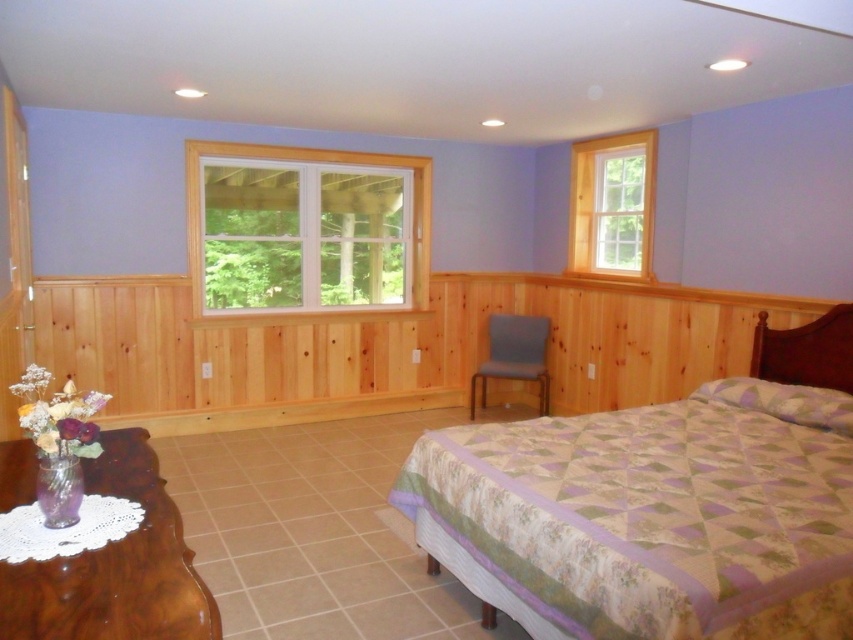
You are standing in the bedroom and want to look outside through the clear glass window at upper right. To do so, which direction should you move relative to the matte blue chair at center?

You should move to the right of the matte blue chair at center because the clear glass window at upper right is located to the right of the matte blue chair at center.

You are an interior designer planning to place a new piece of furniture in the bedroom. You have a choice between a small side table and a large bookshelf. The patterned fabric bed at center and the translucent glass vase at lower left are already in the room. Which existing object should you consider in terms of size when deciding where to place the large bookshelf?

The patterned fabric bed at center has a larger size compared to the translucent glass vase at lower left, so you should consider the size of the patterned fabric bed at center when deciding where to place the large bookshelf.

You are an interior designer planning to place a new decorative item between the clear glass window at upper right and the matte blue chair at center. Which object should the item be placed closer to if it needs to occupy less space horizontally?

The decorative item should be placed closer to the clear glass window at upper right because it is thinner, requiring less horizontal space compared to the matte blue chair at center.